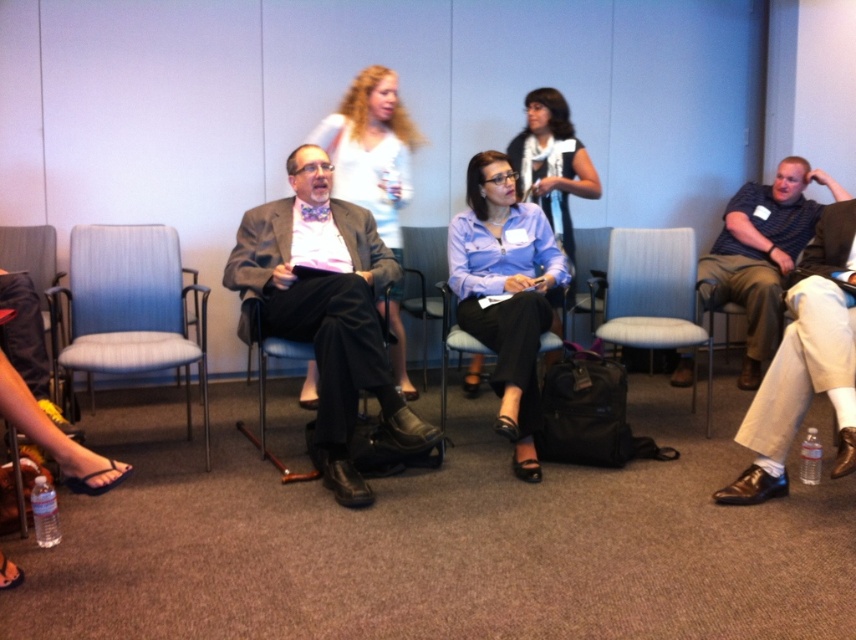
Question: Is matte gray suit at center thinner than dark gray fabric chair at left?

Choices:
 (A) yes
 (B) no

Answer: (B)

Question: Estimate the real-world distances between objects in this image. Which object is closer to the matte white blouse at center?

Choices:
 (A) blue fabric shirt at center
 (B) matte black chair at center

Answer: (B)

Question: Is blue fabric chair at left closer to the viewer compared to dark gray fabric chair at left?

Choices:
 (A) no
 (B) yes

Answer: (A)

Question: Which object is farther from the camera taking this photo?

Choices:
 (A) dark gray fabric chair at left
 (B) brown leather shoes at lower right

Answer: (A)

Question: Does black leather chair at center appear on the right side of black fabric chair at center?

Choices:
 (A) no
 (B) yes

Answer: (A)

Question: Which point is closer to the camera?

Choices:
 (A) blue fabric chair at left
 (B) brown leather shoes at lower right
 (C) blue fabric shirt at center
 (D) matte white blouse at center

Answer: (B)